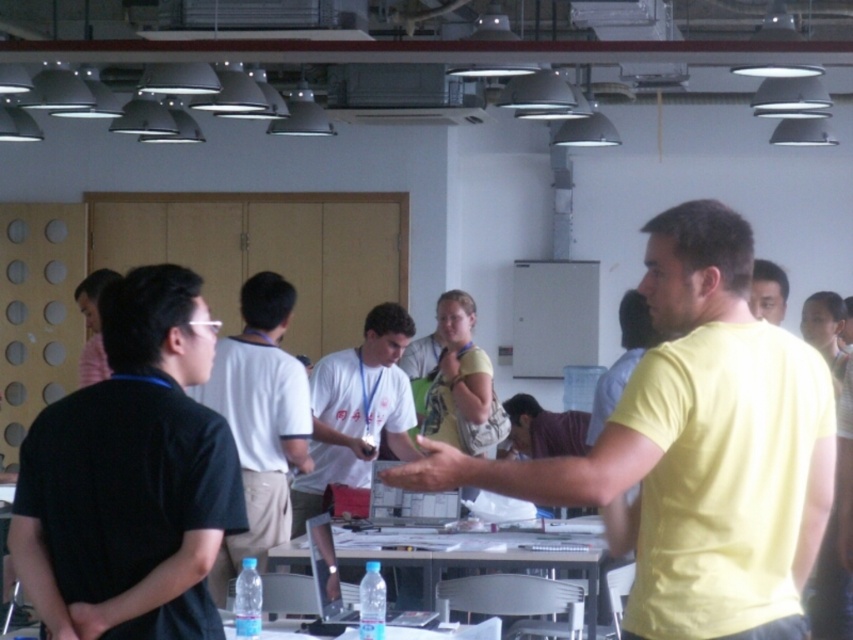
Between point (163, 516) and point (755, 314), which one is positioned behind?

Positioned behind is point (755, 314).

Is black matte shirt at left wider than matte yellow shirt at center?

Yes.

Measure the distance between black matte shirt at left and camera.

black matte shirt at left and camera are 4.26 meters apart.

The width and height of the screenshot is (853, 640). Find the location of `black matte shirt at left`. black matte shirt at left is located at coordinates (131, 477).

Is point (77, 520) farther from viewer compared to point (252, 497)?

No, it is not.

How much distance is there between black matte shirt at left and black cotton shirt at center?

black matte shirt at left is 9.80 feet away from black cotton shirt at center.

You are a GUI agent. You are given a task and a screenshot of the screen. Output one action in this format:
    pyautogui.click(x=<x>, y=<y>)
    Task: Click on the black matte shirt at left
    This screenshot has width=853, height=640.
    Given the screenshot: What is the action you would take?
    pyautogui.click(x=131, y=477)

Is yellow matte shirt at center taller than black matte shirt at left?

Yes.

Does yellow matte shirt at center appear under black matte shirt at left?

No.

Is point (831, 497) positioned after point (119, 493)?

No, (831, 497) is in front of (119, 493).

Find the location of a particular element. This screenshot has height=640, width=853. yellow matte shirt at center is located at coordinates (695, 449).